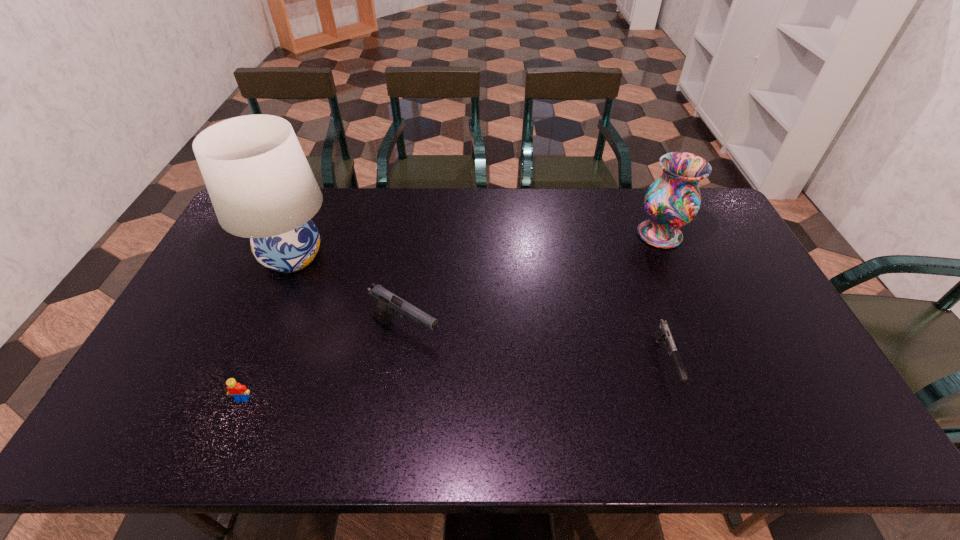
The width and height of the screenshot is (960, 540). Identify the location of free space between the Lego and the rightmost object. (451, 316).

What are the coordinates of `vacant area between the Lego and the shorter gun` in the screenshot? It's located at (454, 380).

The width and height of the screenshot is (960, 540). What are the coordinates of `unoccupied position between the tallest object and the shorter gun` in the screenshot? It's located at (479, 309).

Image resolution: width=960 pixels, height=540 pixels. Find the location of `object that is the closest to the left gun`. object that is the closest to the left gun is located at coordinates (259, 181).

This screenshot has height=540, width=960. What are the coordinates of `object that stands as the closest to the left gun` in the screenshot? It's located at pos(259,181).

The height and width of the screenshot is (540, 960). In order to click on free space that satisfies the following two spatial constraints: 1. at the muzzle of the left gun; 2. on the face of the Lego in this screenshot , I will do `click(396, 399)`.

Identify the location of free space that satisfies the following two spatial constraints: 1. at the muzzle of the taller gun; 2. on the face of the Lego. The width and height of the screenshot is (960, 540). (396, 399).

The width and height of the screenshot is (960, 540). I want to click on vacant space that satisfies the following two spatial constraints: 1. on the front side of the vase; 2. at the muzzle of the taller gun, so click(703, 335).